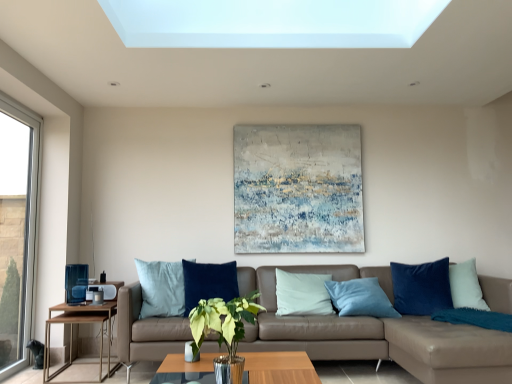
Question: Is clear glass window at left a part of wooden/metallic side table at left?

Choices:
 (A) yes
 (B) no

Answer: (B)

Question: From a real-world perspective, is wooden/metallic side table at left located higher than clear glass window at left?

Choices:
 (A) no
 (B) yes

Answer: (A)

Question: Is wooden/metallic side table at left bigger than clear glass window at left?

Choices:
 (A) no
 (B) yes

Answer: (B)

Question: Is wooden/metallic side table at left turned away from clear glass window at left?

Choices:
 (A) yes
 (B) no

Answer: (B)

Question: Does wooden/metallic side table at left have a lesser height compared to clear glass window at left?

Choices:
 (A) no
 (B) yes

Answer: (B)

Question: Is textured canvas painting at center in front of or behind wooden/metallic side table at left in the image?

Choices:
 (A) behind
 (B) front

Answer: (A)

Question: Considering the positions of textured canvas painting at center and wooden/metallic side table at left in the image, is textured canvas painting at center taller or shorter than wooden/metallic side table at left?

Choices:
 (A) tall
 (B) short

Answer: (A)

Question: From a real-world perspective, is textured canvas painting at center above or below wooden/metallic side table at left?

Choices:
 (A) above
 (B) below

Answer: (A)

Question: Would you say textured canvas painting at center is to the left or to the right of wooden/metallic side table at left in the picture?

Choices:
 (A) right
 (B) left

Answer: (A)

Question: Based on their sizes in the image, would you say translucent glass coffee table at center is bigger or smaller than leather couch at center?

Choices:
 (A) big
 (B) small

Answer: (B)

Question: From the image's perspective, is translucent glass coffee table at center positioned above or below leather couch at center?

Choices:
 (A) below
 (B) above

Answer: (A)

Question: Which is correct: translucent glass coffee table at center is inside leather couch at center, or outside of it?

Choices:
 (A) inside
 (B) outside

Answer: (A)

Question: From a real-world perspective, is translucent glass coffee table at center positioned above or below leather couch at center?

Choices:
 (A) below
 (B) above

Answer: (A)

Question: From a real-world perspective, is wooden/metallic side table at left positioned above or below textured canvas painting at center?

Choices:
 (A) below
 (B) above

Answer: (A)

Question: Is point (109, 339) positioned closer to the camera than point (342, 140)?

Choices:
 (A) farther
 (B) closer

Answer: (B)